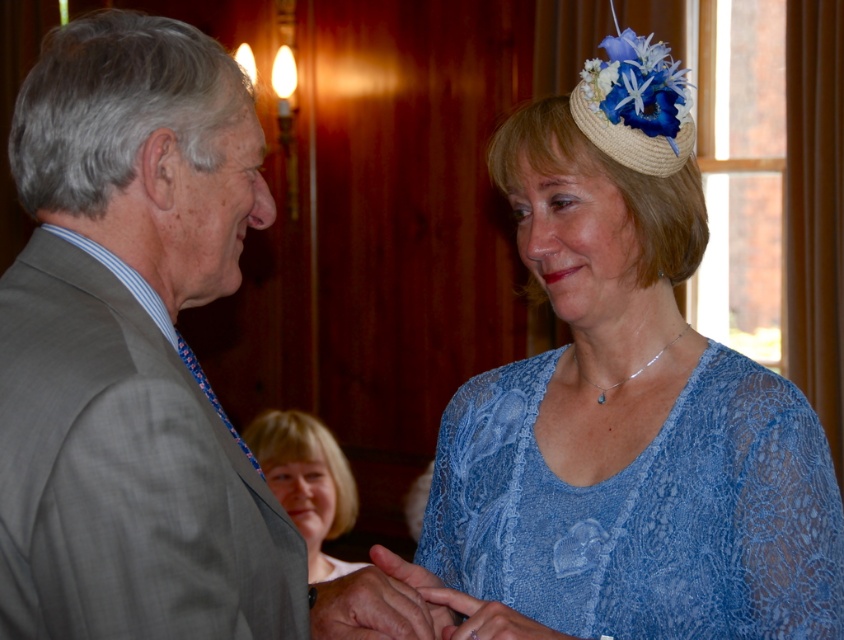
Can you confirm if blonde hair at lower center is positioned to the left of smooth skin hand at center?

Yes, blonde hair at lower center is to the left of smooth skin hand at center.

Does blonde hair at lower center lie behind smooth skin hand at center?

Yes, it is behind smooth skin hand at center.

Which is behind, point (260, 435) or point (315, 630)?

The point (260, 435) is more distant.

Where is `blonde hair at lower center`? blonde hair at lower center is located at coordinates (306, 481).

Between point (388, 600) and point (431, 596), which one is positioned in front?

Positioned in front is point (388, 600).

Is smooth skin hand at center above matte blue lace hand at center?

Indeed, smooth skin hand at center is positioned over matte blue lace hand at center.

Which is in front, point (366, 588) or point (460, 636)?

Point (460, 636) is more forward.

Find the location of a particular element. The image size is (844, 640). smooth skin hand at center is located at coordinates (374, 609).

Between point (253, 444) and point (463, 596), which one is positioned in front?

Point (463, 596) is in front.

Which of these two, blonde hair at lower center or matte blue lace hand at center, stands taller?

Standing taller between the two is blonde hair at lower center.

Does point (288, 504) come behind point (485, 636)?

Yes, point (288, 504) is behind point (485, 636).

Image resolution: width=844 pixels, height=640 pixels. Find the location of `blonde hair at lower center`. blonde hair at lower center is located at coordinates (306, 481).